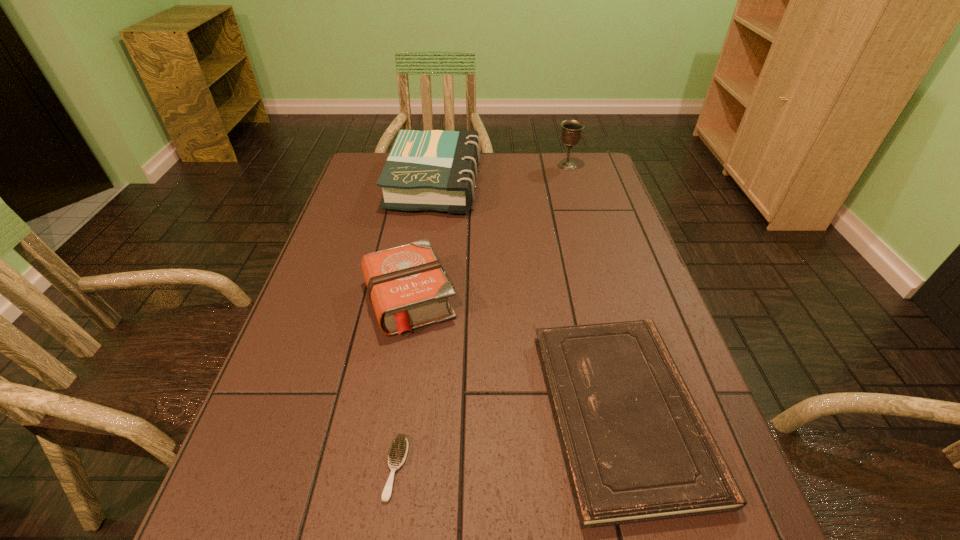
This screenshot has width=960, height=540. I want to click on the tallest object, so click(571, 133).

Image resolution: width=960 pixels, height=540 pixels. I want to click on the farther paperback book, so click(x=436, y=170).

Locate an element on the screen. the taller paperback book is located at coordinates (436, 170).

In order to click on the third tallest object in this screenshot , I will do `click(407, 286)`.

The image size is (960, 540). I want to click on the shorter paperback book, so click(636, 448).

Find the location of a particular element. the right paperback book is located at coordinates (636, 448).

The image size is (960, 540). Find the location of `the shortest object`. the shortest object is located at coordinates (398, 451).

Find the location of a particular element. vacant area situated 0.350m on the left of the chalice is located at coordinates (453, 165).

Locate an element on the screen. This screenshot has width=960, height=540. vacant region located on the left of the left paperback book is located at coordinates (374, 184).

At what (x,y) coordinates should I click in order to perform the action: click on vacant position located on the back of the third tallest object. Please return your answer as a coordinate pair (x, y). This screenshot has width=960, height=540. Looking at the image, I should click on (426, 191).